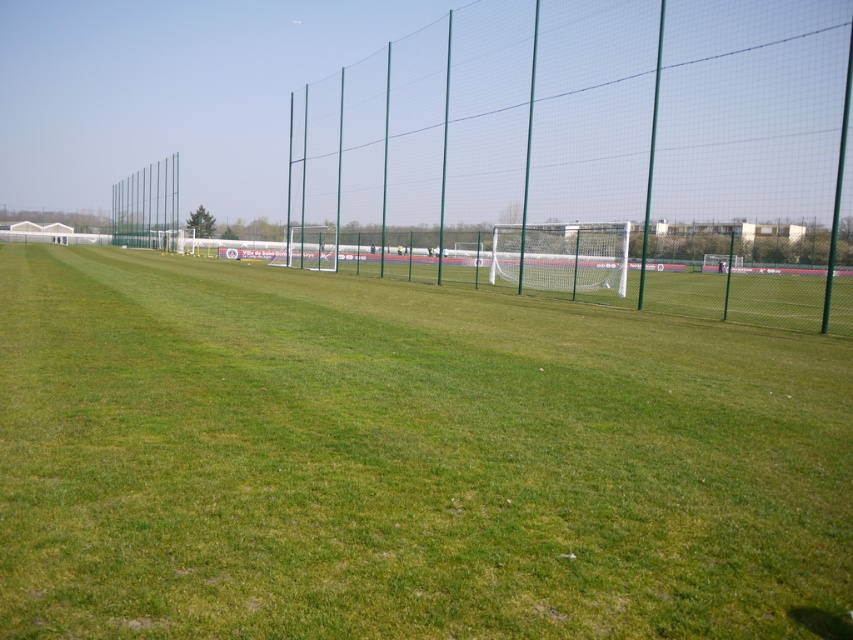
You are a soccer player standing on the field and want to kick a ball towards the goal. You notice the green grass at center and the green mesh fence at upper left. Which object is shorter in height?

The green grass at center has a lesser height compared to the green mesh fence at upper left, so the green grass at center is shorter in height.

You are a soccer player standing on the field and see the green mesh fence at center and the green mesh fence at upper left. Which fence is closer to you?

The green mesh fence at center is closer to you because it is positioned over the green mesh fence at upper left, indicating it is in front.